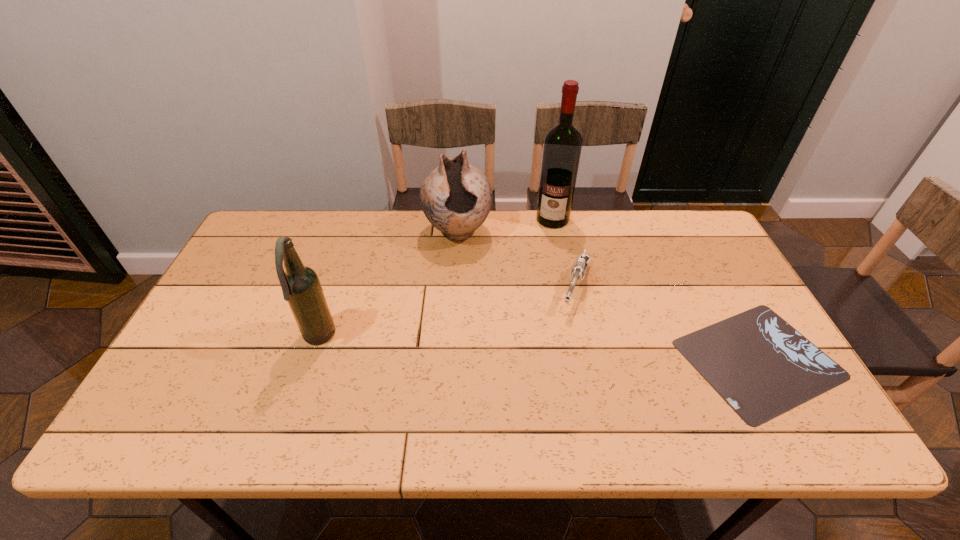
Locate an element on the screen. free spot between the tallest object and the pottery is located at coordinates (505, 226).

Find the location of a particular element. The image size is (960, 540). free space between the beer bottle and the second shortest object is located at coordinates (447, 313).

Find the location of `blank region between the gun and the pottery`. blank region between the gun and the pottery is located at coordinates (516, 260).

The image size is (960, 540). What are the coordinates of `empty space that is in between the second object from left to right and the alcohol` in the screenshot? It's located at (505, 226).

Where is `free space between the second shortest object and the second object from left to right`? free space between the second shortest object and the second object from left to right is located at coordinates (516, 260).

Find the location of a particular element. The image size is (960, 540). free point between the rightmost object and the pottery is located at coordinates (608, 295).

Locate an element on the screen. The width and height of the screenshot is (960, 540). object that is the nearest to the gun is located at coordinates (758, 363).

Select which object appears as the second closest to the leftmost object. Please provide its 2D coordinates. Your answer should be formatted as a tuple, i.e. [(x, y)], where the tuple contains the x and y coordinates of a point satisfying the conditions above.

[(578, 271)]

Locate an element on the screen. This screenshot has width=960, height=540. free spot that satisfies the following two spatial constraints: 1. on the back side of the leftmost object; 2. on the left side of the tallest object is located at coordinates (358, 219).

Locate an element on the screen. The image size is (960, 540). free space that satisfies the following two spatial constraints: 1. on the back side of the second object from left to right; 2. on the right side of the alcohol is located at coordinates (459, 219).